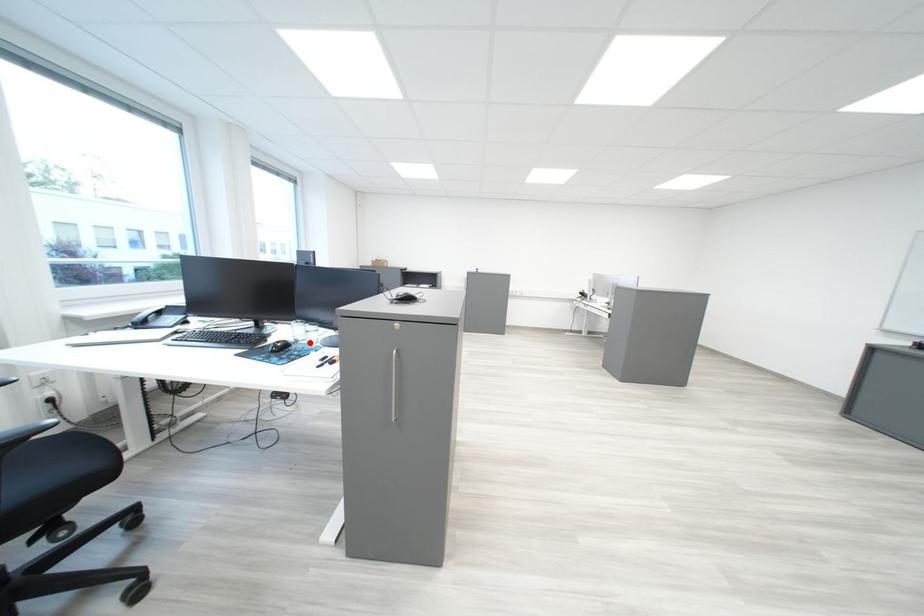
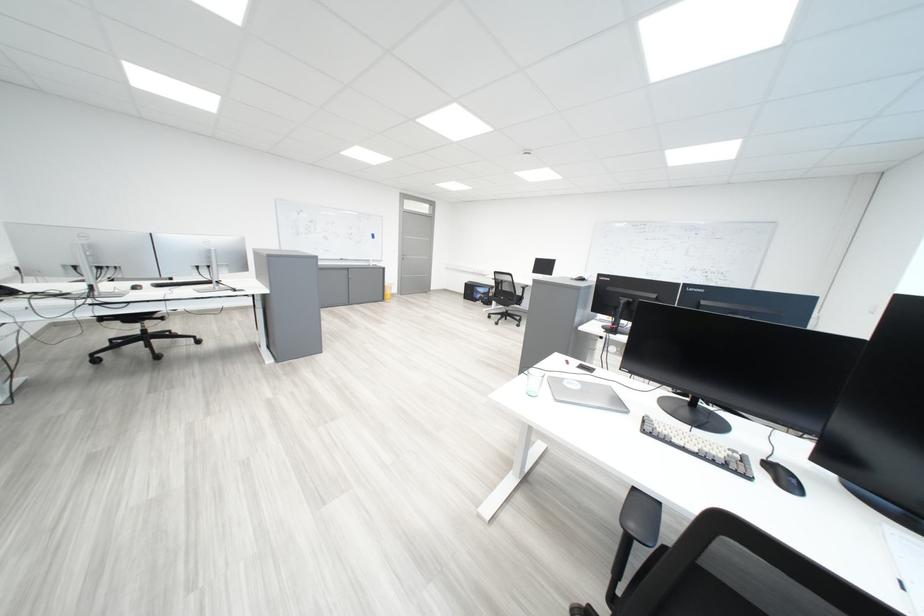
Question: I am providing you with two images of the same scene from different viewpoints. A red point is marked on the first image. Is the red point's position out of view in image 2?

Choices:
 (A) Yes
 (B) No

Answer: (A)